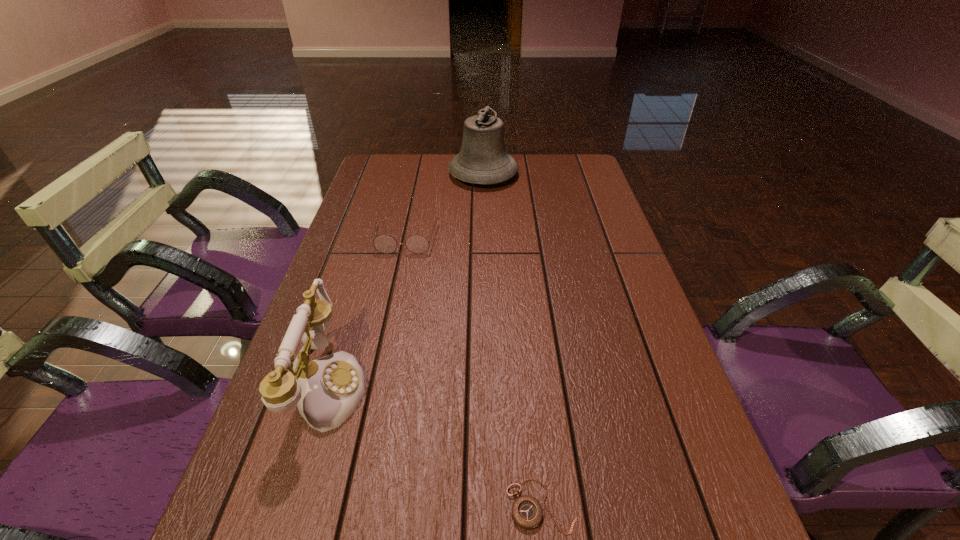
Where is `vacant area that lies between the nearest object and the spectacles`? Image resolution: width=960 pixels, height=540 pixels. vacant area that lies between the nearest object and the spectacles is located at coordinates (473, 372).

Locate an element on the screen. This screenshot has height=540, width=960. free space between the second tallest object and the nearest object is located at coordinates (434, 446).

This screenshot has width=960, height=540. I want to click on free point between the spectacles and the bell, so click(x=444, y=207).

Image resolution: width=960 pixels, height=540 pixels. What are the coordinates of `free space between the farthest object and the second farthest object` in the screenshot? It's located at (444, 207).

The width and height of the screenshot is (960, 540). I want to click on free point between the bell and the pocket watch, so click(x=512, y=340).

Where is `free spot between the second farthest object and the farthest object`? free spot between the second farthest object and the farthest object is located at coordinates (444, 207).

Image resolution: width=960 pixels, height=540 pixels. In order to click on free space between the pocket watch and the telephone in this screenshot , I will do `click(434, 446)`.

The image size is (960, 540). Identify the location of empty space between the tallest object and the shortest object. (512, 340).

You are a GUI agent. You are given a task and a screenshot of the screen. Output one action in this format:
    pyautogui.click(x=<x>, y=<y>)
    Task: Click on the empty location between the third nearest object and the nearest object
    The height and width of the screenshot is (540, 960).
    Given the screenshot: What is the action you would take?
    pyautogui.click(x=473, y=372)

This screenshot has width=960, height=540. Find the location of `vacant point located between the telephone and the bell`. vacant point located between the telephone and the bell is located at coordinates (405, 280).